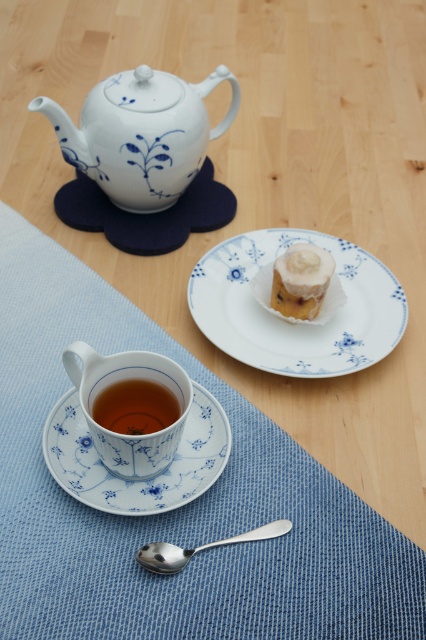
Between white porcelain saucer at lower center and translucent glass cup at lower center, which one appears on the left side from the viewer's perspective?

From the viewer's perspective, white porcelain saucer at lower center appears more on the left side.

Is white porcelain saucer at lower center bigger than translucent glass cup at lower center?

Yes.

Does point (54, 419) lie in front of point (158, 410)?

No, (54, 419) is further to viewer.

This screenshot has height=640, width=426. Identify the location of white porcelain saucer at lower center. (137, 480).

Consider the image. Does white porcelain plate at center have a larger size compared to white porcelain saucer at lower center?

Correct, white porcelain plate at center is larger in size than white porcelain saucer at lower center.

Between point (219, 252) and point (58, 403), which one is positioned in front?

Point (58, 403)

Locate an element on the screen. The width and height of the screenshot is (426, 640). white porcelain plate at center is located at coordinates (299, 323).

Can you confirm if blue woven placemat at lower left is shorter than matte porcelain cup at lower center?

In fact, blue woven placemat at lower left may be taller than matte porcelain cup at lower center.

Which is below, blue woven placemat at lower left or matte porcelain cup at lower center?

blue woven placemat at lower left

What do you see at coordinates (175, 508) in the screenshot? I see `blue woven placemat at lower left` at bounding box center [175, 508].

Find the location of `blue woven placemat at lower left`. blue woven placemat at lower left is located at coordinates (175, 508).